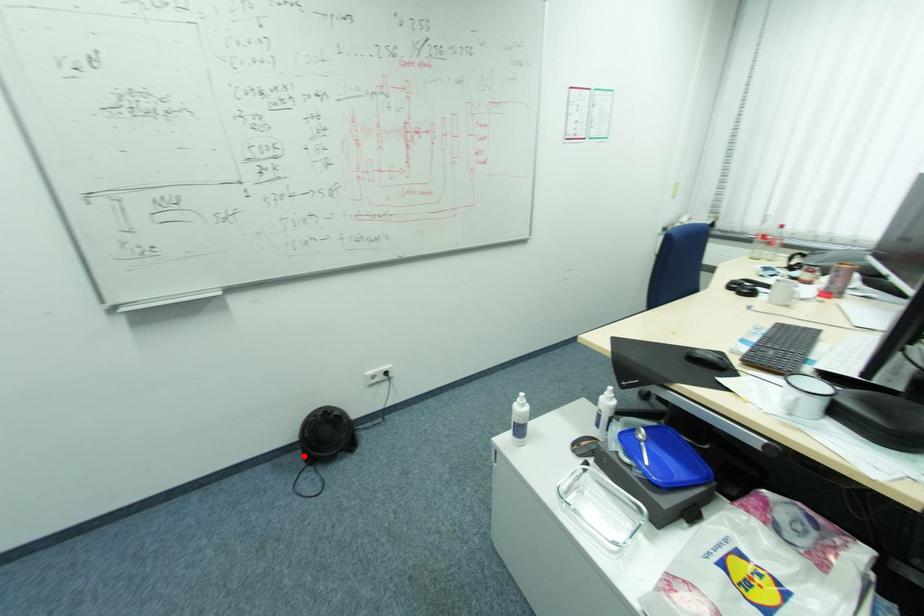
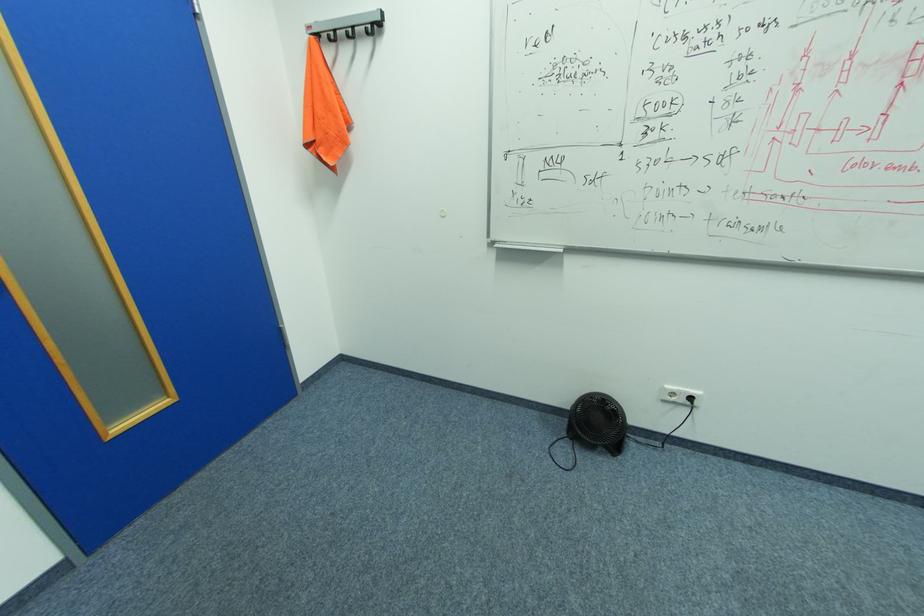
Question: I am providing you with two images of the same scene from different viewpoints. Given a red point in image1, look at the same physical point in image2. Is it:

Choices:
 (A) Closer to the viewpoint
 (B) Farther from the viewpoint

Answer: (A)